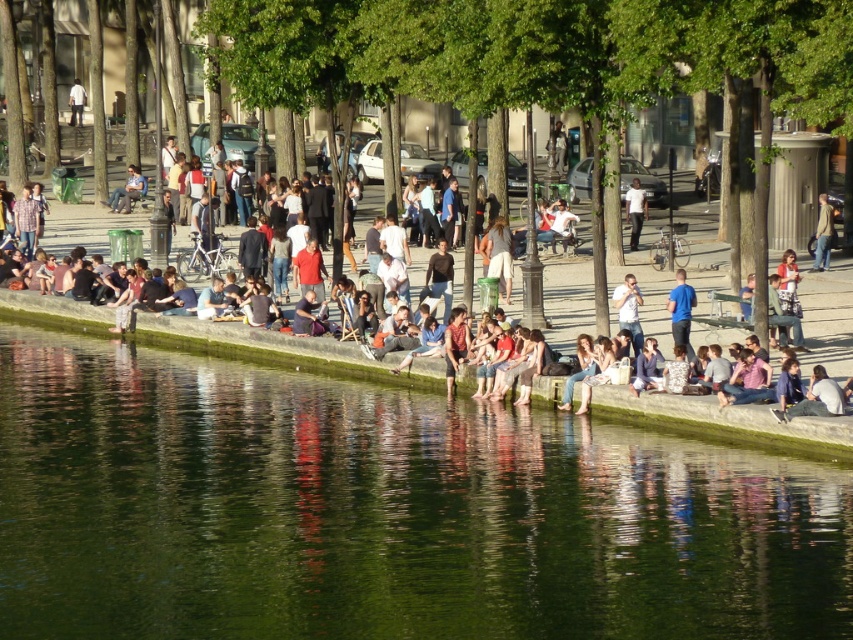
You are a photographer standing at the edge of the river and want to capture a person wearing a blue cotton shirt at center. According to the coordinates provided, where should you aim your camera to find them?

The blue cotton shirt at center is located at point (682,310), so you should aim your camera there to capture the person wearing it.

You are standing at the point with coordinates point (x=633, y=301) and want to move towards the point with coordinates point (x=677, y=310). Which direction should you move to reach your destination?

You should move forward because point (x=677, y=310) is in front of point (x=633, y=301).